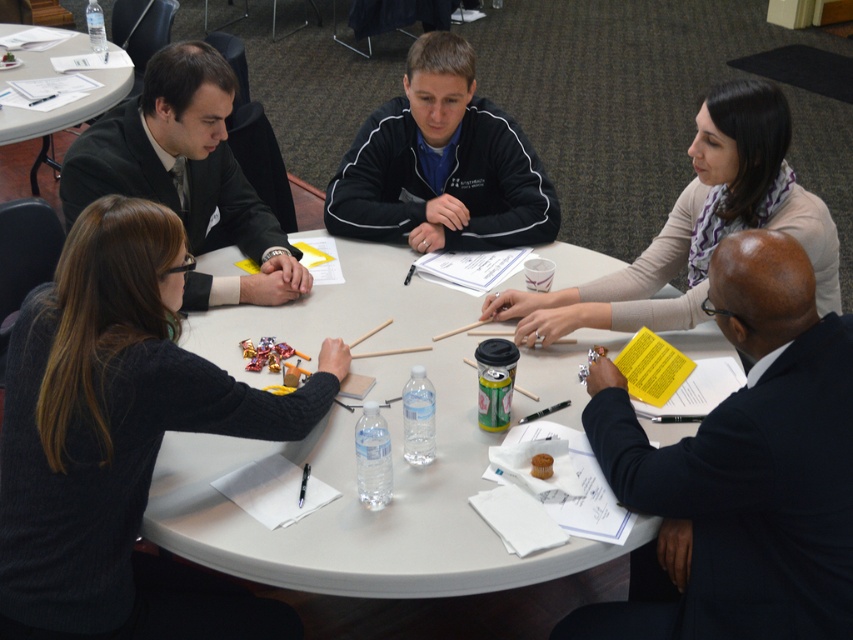
Question: Is black fleece jacket at center above matte black suit at upper left?

Choices:
 (A) yes
 (B) no

Answer: (A)

Question: Which is nearer to the matte black suit at upper left?

Choices:
 (A) black fleece jacket at center
 (B) light beige scarf at upper right
 (C) white plastic table at upper left

Answer: (A)

Question: Does black fleece jacket at center lie behind white plastic table at upper left?

Choices:
 (A) no
 (B) yes

Answer: (A)

Question: Which object appears farthest from the camera in this image?

Choices:
 (A) black fleece jacket at center
 (B) light beige scarf at upper right
 (C) white plastic table at center
 (D) black suit at lower right

Answer: (A)

Question: Is black suit at lower right to the left of black fleece jacket at center from the viewer's perspective?

Choices:
 (A) no
 (B) yes

Answer: (A)

Question: Among these points, which one is farthest from the camera?

Choices:
 (A) (666, 493)
 (B) (576, 326)

Answer: (B)